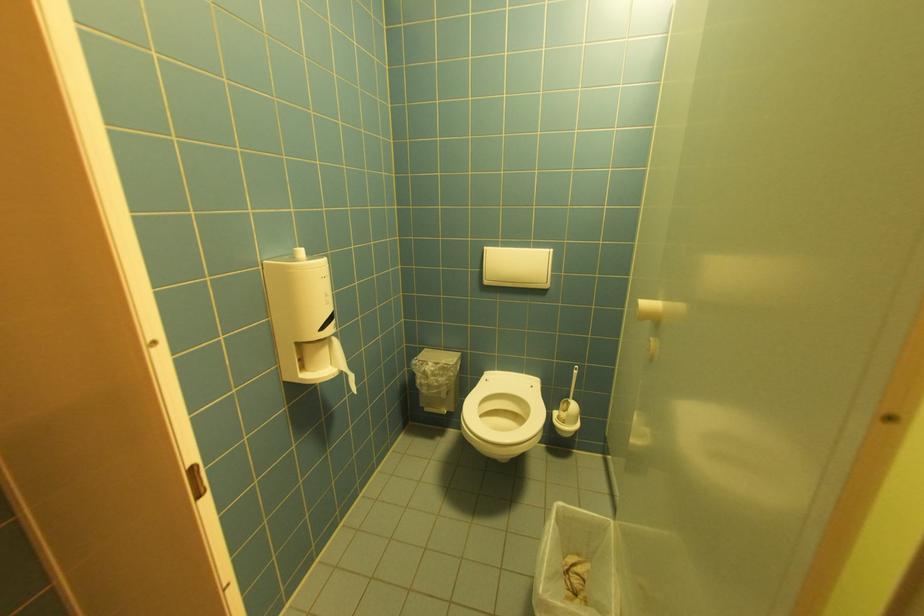
Identify the location of recessed door handle. (196, 480).